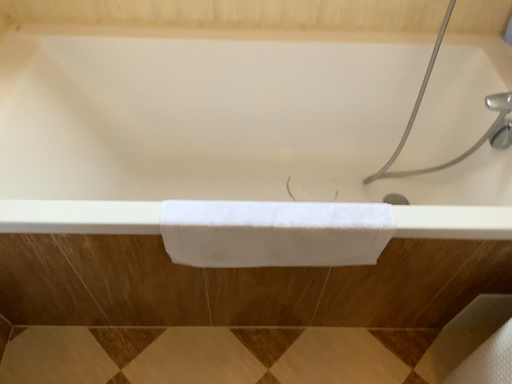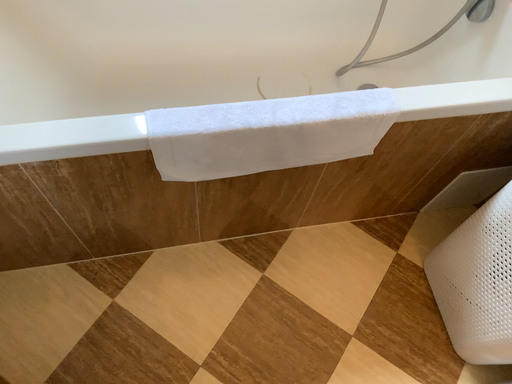
Question: Which way did the camera rotate in the video?

Choices:
 (A) rotated left
 (B) rotated right

Answer: (B)